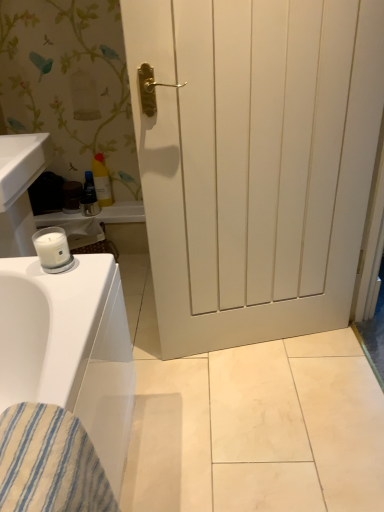
Question: From the image's perspective, is yellow plastic bottle at upper left, the first toiletry from the right, located above blue striped fabric at lower left?

Choices:
 (A) yes
 (B) no

Answer: (A)

Question: Does yellow plastic bottle at upper left, the second toiletry in the left-to-right sequence, have a smaller size compared to blue striped fabric at lower left?

Choices:
 (A) yes
 (B) no

Answer: (A)

Question: Is yellow plastic bottle at upper left, the second toiletry in the left-to-right sequence, at the left side of blue striped fabric at lower left?

Choices:
 (A) yes
 (B) no

Answer: (A)

Question: Is yellow plastic bottle at upper left, the first toiletry from the right, oriented towards blue striped fabric at lower left?

Choices:
 (A) yes
 (B) no

Answer: (A)

Question: Is yellow plastic bottle at upper left, the first toiletry from the right, further to camera compared to blue striped fabric at lower left?

Choices:
 (A) yes
 (B) no

Answer: (A)

Question: Is yellow plastic bottle at upper left, the first toiletry from the right, bigger than blue striped fabric at lower left?

Choices:
 (A) yes
 (B) no

Answer: (B)

Question: Could you tell me if white matte door at center is facing yellow plastic bottle at upper left, the second toiletry in the left-to-right sequence?

Choices:
 (A) no
 (B) yes

Answer: (A)

Question: Is yellow plastic bottle at upper left, the second toiletry in the left-to-right sequence, surrounded by white matte door at center?

Choices:
 (A) no
 (B) yes

Answer: (A)

Question: From the image's perspective, would you say white matte door at center is positioned over yellow plastic bottle at upper left, the second toiletry in the left-to-right sequence?

Choices:
 (A) yes
 (B) no

Answer: (B)

Question: Is white matte door at center at the right side of yellow plastic bottle at upper left, the second toiletry in the left-to-right sequence?

Choices:
 (A) yes
 (B) no

Answer: (A)

Question: Is white matte door at center further to camera compared to yellow plastic bottle at upper left, the second toiletry in the left-to-right sequence?

Choices:
 (A) no
 (B) yes

Answer: (A)

Question: Is white matte door at center placed right next to yellow plastic bottle at upper left, the first toiletry from the right?

Choices:
 (A) yes
 (B) no

Answer: (B)

Question: Is the surface of yellow plastic bottle at upper left, the first toiletry from the right, in direct contact with blue glossy tube at center, which is the first toiletry in left-to-right order?

Choices:
 (A) no
 (B) yes

Answer: (B)